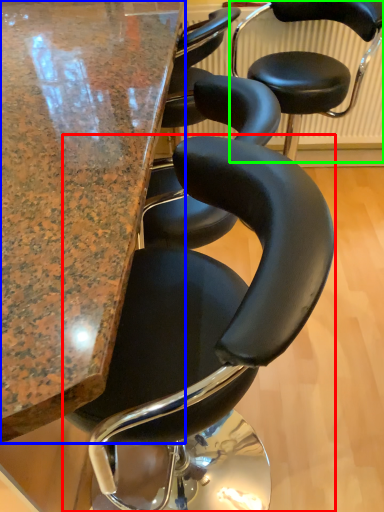
Question: Based on their relative distances, which object is nearer to chair (highlighted by a red box)? Choose from table (highlighted by a blue box) and chair (highlighted by a green box).

Choices:
 (A) table
 (B) chair

Answer: (A)